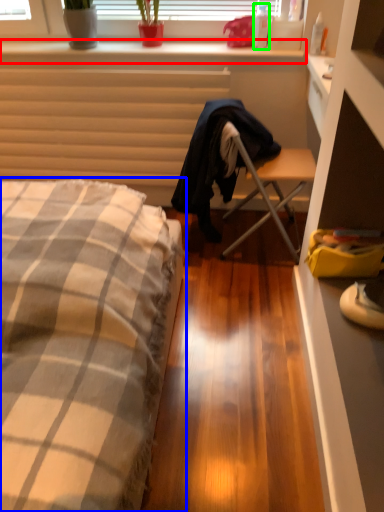
Question: Estimate the real-world distances between objects in this image. Which object is closer to window sill (highlighted by a red box), bed (highlighted by a blue box) or bottle (highlighted by a green box)?

Choices:
 (A) bed
 (B) bottle

Answer: (B)